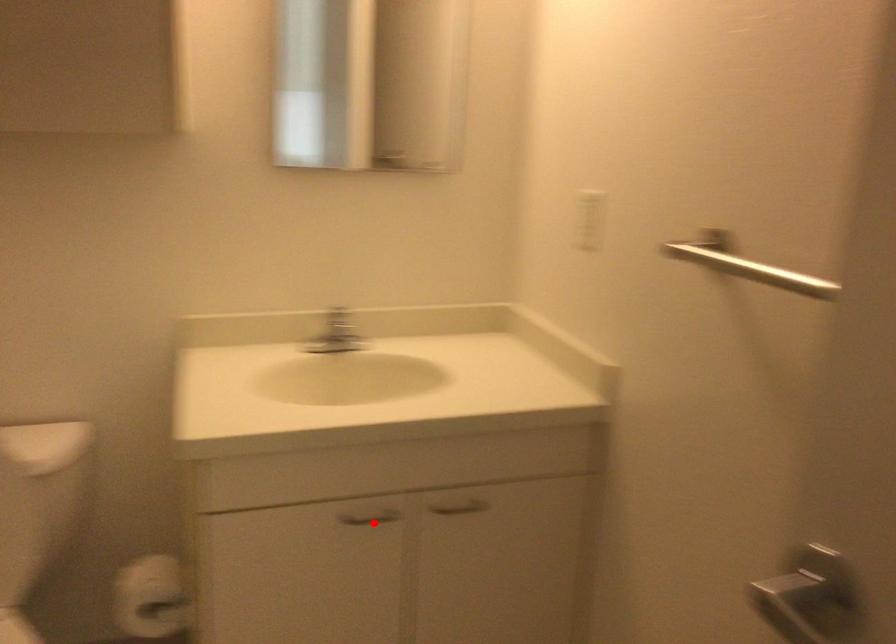
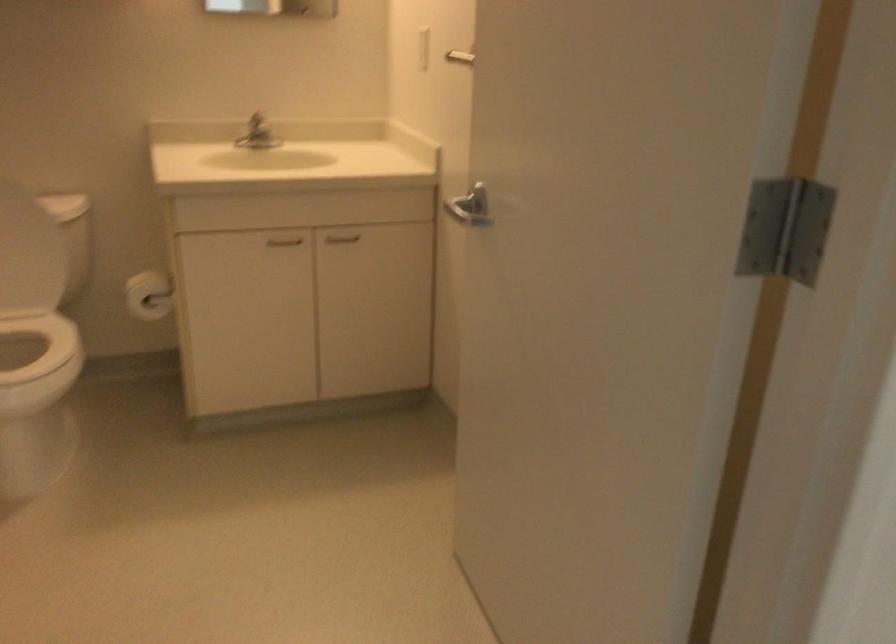
Locate, in the second image, the point that corresponds to the highlighted location in the first image.

(283, 241)